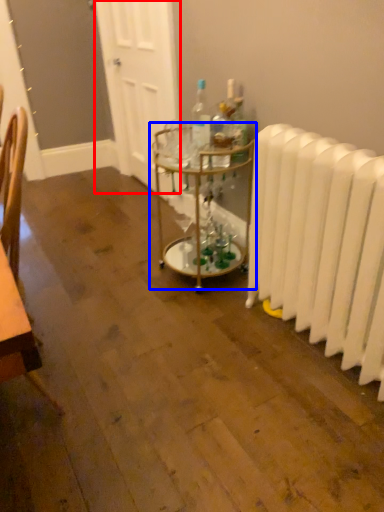
Question: Which object is further to the camera taking this photo, door (highlighted by a red box) or table (highlighted by a blue box)?

Choices:
 (A) door
 (B) table

Answer: (A)